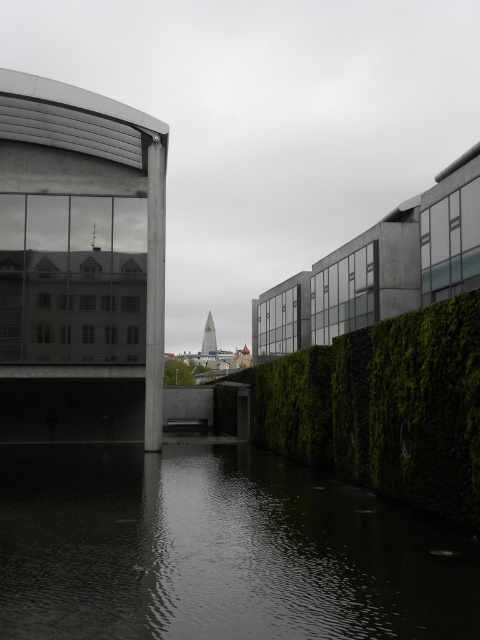
Between dark reflective water at bottom and green mossy hedge at center, which one is positioned higher?

Positioned higher is dark reflective water at bottom.

Does dark reflective water at bottom appear on the right side of green mossy hedge at center?

In fact, dark reflective water at bottom is to the left of green mossy hedge at center.

At what (x,y) coordinates should I click in order to perform the action: click on dark reflective water at bottom. Please return your answer as a coordinate pair (x, y). Looking at the image, I should click on pyautogui.click(x=217, y=548).